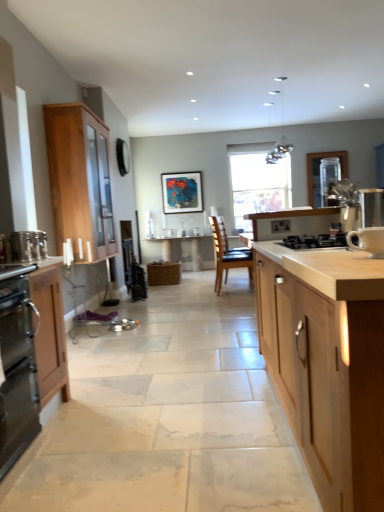
Image resolution: width=384 pixels, height=512 pixels. What do you see at coordinates (184, 251) in the screenshot? I see `wooden table at center` at bounding box center [184, 251].

Identify the location of transparent glass window at center. This screenshot has width=384, height=512. (258, 181).

Identify the location of light wood cabinet at center, which ranks as the third cabinetry in back-to-front order. (327, 364).

From the image's perspective, is brown leather chair at center positioned above or below matte wood countertop at left?

From the image's perspective, brown leather chair at center appears above matte wood countertop at left.

How far apart are brown leather chair at center and matte wood countertop at left?

The distance of brown leather chair at center from matte wood countertop at left is 3.40 meters.

Locate an element on the screen. countertop located above the brown leather chair at center (from a real-world perspective) is located at coordinates (26, 267).

Based on their sizes in the image, would you say brown leather chair at center is bigger or smaller than matte wood countertop at left?

Clearly, brown leather chair at center is larger in size than matte wood countertop at left.

Consider the image. In the image, is light wood cabinet at center, which ranks as the third cabinetry in back-to-front order, on the left side or the right side of black matte gas stove at center?

Clearly, light wood cabinet at center, which ranks as the third cabinetry in back-to-front order, is on the right of black matte gas stove at center in the image.

How many degrees apart are the facing directions of light wood cabinet at center, positioned as the first cabinetry in right-to-left order, and black matte gas stove at center?

The facing directions of light wood cabinet at center, positioned as the first cabinetry in right-to-left order, and black matte gas stove at center are 90.2 degrees apart.

Which is behind, point (298, 280) or point (309, 243)?

Point (309, 243)

Is light wood cabinet at center, positioned as the first cabinetry in right-to-left order, outside of black matte gas stove at center?

Absolutely, light wood cabinet at center, positioned as the first cabinetry in right-to-left order, is external to black matte gas stove at center.

Is brown leather chair at center aimed at light wood cabinet at center, the 3th cabinetry positioned from the left?

No, brown leather chair at center is not facing towards light wood cabinet at center, the 3th cabinetry positioned from the left.

Is brown leather chair at center bigger or smaller than light wood cabinet at center, which is counted as the 1th cabinetry, starting from the front?

Considering their sizes, brown leather chair at center takes up less space than light wood cabinet at center, which is counted as the 1th cabinetry, starting from the front.

From a real-world perspective, is brown leather chair at center physically above light wood cabinet at center, positioned as the first cabinetry in right-to-left order?

No, from a real-world perspective, brown leather chair at center is not on top of light wood cabinet at center, positioned as the first cabinetry in right-to-left order.

Between brown leather chair at center and light wood cabinet at center, which ranks as the third cabinetry in back-to-front order, which one has more height?

brown leather chair at center.

Is wooden table at center at the left side of metallic silver toaster at left, positioned as the 3th appliance in front-to-back order?

No.

Is wooden table at center taller than metallic silver toaster at left, which ranks as the third appliance in right-to-left order?

Yes, wooden table at center is taller than metallic silver toaster at left, which ranks as the third appliance in right-to-left order.

Does wooden table at center turn towards metallic silver toaster at left, the first appliance from the back?

Yes.

From the image's perspective, between white ceramic mug at upper right, marked as the third appliance in a left-to-right arrangement, and wooden table at center, who is located below?

wooden table at center is shown below in the image.

Is white ceramic mug at upper right, which is the first appliance in right-to-left order, wider than wooden table at center?

In fact, white ceramic mug at upper right, which is the first appliance in right-to-left order, might be narrower than wooden table at center.

From a real-world perspective, does white ceramic mug at upper right, which is the first appliance in right-to-left order, stand above wooden table at center?

Indeed, from a real-world perspective, white ceramic mug at upper right, which is the first appliance in right-to-left order, stands above wooden table at center.

Is white ceramic mug at upper right, marked as the third appliance in a left-to-right arrangement, positioned with its back to wooden table at center?

That's not correct — white ceramic mug at upper right, marked as the third appliance in a left-to-right arrangement, is not looking away from wooden table at center.

From a real-world perspective, which is physically below, metallic silver toaster at left, which ranks as the third appliance in right-to-left order, or metallic glass pendant lights at upper center?

metallic silver toaster at left, which ranks as the third appliance in right-to-left order.

Considering the sizes of objects metallic silver toaster at left, the first appliance from the back, and metallic glass pendant lights at upper center in the image provided, who is wider, metallic silver toaster at left, the first appliance from the back, or metallic glass pendant lights at upper center?

With larger width is metallic glass pendant lights at upper center.

Can you confirm if metallic silver toaster at left, which ranks as the third appliance in right-to-left order, is smaller than metallic glass pendant lights at upper center?

Yes, metallic silver toaster at left, which ranks as the third appliance in right-to-left order, is smaller than metallic glass pendant lights at upper center.

Could you tell me if metallic silver toaster at left, the first appliance from the back, is turned towards metallic glass pendant lights at upper center?

No, metallic silver toaster at left, the first appliance from the back, is not turned towards metallic glass pendant lights at upper center.

From the picture: Is metallic silver toaster at left, positioned as the 3th appliance in front-to-back order, taller or shorter than light wood cabinet at center, which is counted as the 1th cabinetry, starting from the front?

Considering their sizes, metallic silver toaster at left, positioned as the 3th appliance in front-to-back order, has less height than light wood cabinet at center, which is counted as the 1th cabinetry, starting from the front.

This screenshot has width=384, height=512. Find the location of `the 2nd appliance positioned above the light wood cabinet at center, positioned as the first cabinetry in right-to-left order (from a real-world perspective)`. the 2nd appliance positioned above the light wood cabinet at center, positioned as the first cabinetry in right-to-left order (from a real-world perspective) is located at coordinates (28, 245).

Considering the positions of point (27, 254) and point (305, 312), is point (27, 254) closer or farther from the camera than point (305, 312)?

Point (27, 254) is farther from the camera than point (305, 312).

From a real-world perspective, is metallic silver toaster at left, which ranks as the third appliance in right-to-left order, physically below light wood cabinet at center, which ranks as the third cabinetry in back-to-front order?

Actually, metallic silver toaster at left, which ranks as the third appliance in right-to-left order, is physically above light wood cabinet at center, which ranks as the third cabinetry in back-to-front order, in the real world.

Identify the location of chair to the right of matte wood countertop at left. (228, 255).

Locate an element on the screen. The image size is (384, 512). gas stove located on the left of light wood cabinet at center, which ranks as the third cabinetry in back-to-front order is located at coordinates (314, 241).

Based on the photo, when comparing their distances from wooden table at center, does light wood cabinet at center, which is counted as the 1th cabinetry, starting from the front, or white ceramic mug at right, positioned as the first appliance in front-to-back order, seem further?

The object further to wooden table at center is white ceramic mug at right, positioned as the first appliance in front-to-back order.

Looking at the image, which one is located closer to light wood cabinet at left, which is the third cabinetry from front to back, wooden table at center or stainless steel oven at left, which is counted as the 2th cabinetry, starting from the left?

stainless steel oven at left, which is counted as the 2th cabinetry, starting from the left, is positioned closer to the anchor light wood cabinet at left, which is the third cabinetry from front to back.

When comparing their distances from wooden table at center, does transparent glass window at center or light wood cabinet at center, positioned as the first cabinetry in right-to-left order, seem further?

light wood cabinet at center, positioned as the first cabinetry in right-to-left order, is further to wooden table at center.

Considering their positions, is white ceramic mug at upper right, marked as the third appliance in a left-to-right arrangement, positioned further to light wood cabinet at left, which ranks as the first cabinetry in left-to-right order, than brown leather chair at center?

white ceramic mug at upper right, marked as the third appliance in a left-to-right arrangement, lies further to light wood cabinet at left, which ranks as the first cabinetry in left-to-right order, than the other object.

Considering their positions, is metallic silver toaster at left, which ranks as the first appliance in left-to-right order, positioned closer to stainless steel oven at left, marked as the 2th cabinetry in a right-to-left arrangement, than transparent glass window at center?

metallic silver toaster at left, which ranks as the first appliance in left-to-right order.

From the image, which object appears to be nearer to wooden table at center, white ceramic mug at upper right, which is counted as the second appliance, starting from the front, or light wood cabinet at center, which ranks as the third cabinetry in back-to-front order?

white ceramic mug at upper right, which is counted as the second appliance, starting from the front, lies closer to wooden table at center than the other object.

Estimate the real-world distances between objects in this image. Which object is further from black matte gas stove at center, white ceramic mug at right, positioned as the 2th appliance in left-to-right order, or white ceramic mug at upper right, placed as the second appliance when sorted from back to front?

white ceramic mug at right, positioned as the 2th appliance in left-to-right order.

Which object lies further to the anchor point metallic silver toaster at left, which ranks as the first appliance in left-to-right order, white ceramic mug at upper right, placed as the second appliance when sorted from back to front, or brown leather chair at center?

brown leather chair at center.

Identify the location of cabinetry between light wood cabinet at center, positioned as the first cabinetry in right-to-left order, and light wood cabinet at left, which is the third cabinetry from front to back, from front to back. This screenshot has width=384, height=512. (50, 331).

The image size is (384, 512). In order to click on countertop between black matte gas stove at center and wooden table at center in the front-back direction in this screenshot , I will do `click(26, 267)`.

This screenshot has width=384, height=512. I want to click on appliance between stainless steel oven at left, which is counted as the 2th cabinetry, starting from the back, and metallic glass pendant lights at upper center from front to back, so click(x=28, y=245).

Locate an element on the screen. countertop between metallic silver toaster at left, the first appliance from the back, and stainless steel oven at left, which is the second cabinetry in front-to-back order, in the up-down direction is located at coordinates (26, 267).